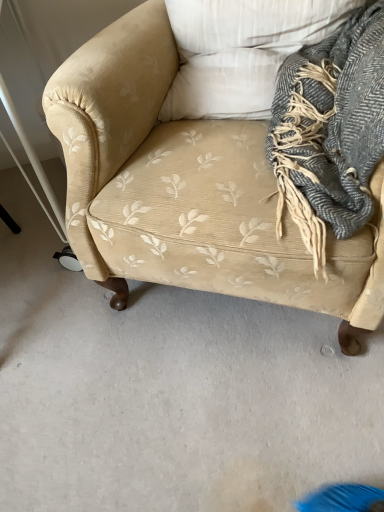
Question: Does beige corduroy couch at center contain gray wool scarf at upper right?

Choices:
 (A) no
 (B) yes

Answer: (B)

Question: From the image's perspective, is beige corduroy couch at center on top of gray wool scarf at upper right?

Choices:
 (A) no
 (B) yes

Answer: (B)

Question: Would you say beige corduroy couch at center is outside gray wool scarf at upper right?

Choices:
 (A) no
 (B) yes

Answer: (B)

Question: From the image's perspective, is beige corduroy couch at center below gray wool scarf at upper right?

Choices:
 (A) yes
 (B) no

Answer: (B)

Question: Can you confirm if beige corduroy couch at center is taller than gray wool scarf at upper right?

Choices:
 (A) no
 (B) yes

Answer: (B)

Question: Are beige corduroy couch at center and gray wool scarf at upper right making contact?

Choices:
 (A) no
 (B) yes

Answer: (A)

Question: Can you confirm if white textured pillow at upper center is wider than gray wool scarf at upper right?

Choices:
 (A) no
 (B) yes

Answer: (A)

Question: From a real-world perspective, is white textured pillow at upper center positioned over gray wool scarf at upper right based on gravity?

Choices:
 (A) yes
 (B) no

Answer: (A)

Question: From a real-world perspective, is white textured pillow at upper center under gray wool scarf at upper right?

Choices:
 (A) no
 (B) yes

Answer: (A)

Question: Does white textured pillow at upper center have a greater height compared to gray wool scarf at upper right?

Choices:
 (A) yes
 (B) no

Answer: (B)

Question: Is white textured pillow at upper center looking in the opposite direction of gray wool scarf at upper right?

Choices:
 (A) yes
 (B) no

Answer: (B)

Question: Is white textured pillow at upper center next to gray wool scarf at upper right and touching it?

Choices:
 (A) no
 (B) yes

Answer: (A)

Question: Is beige corduroy couch at center positioned with its back to white textured pillow at upper center?

Choices:
 (A) no
 (B) yes

Answer: (B)